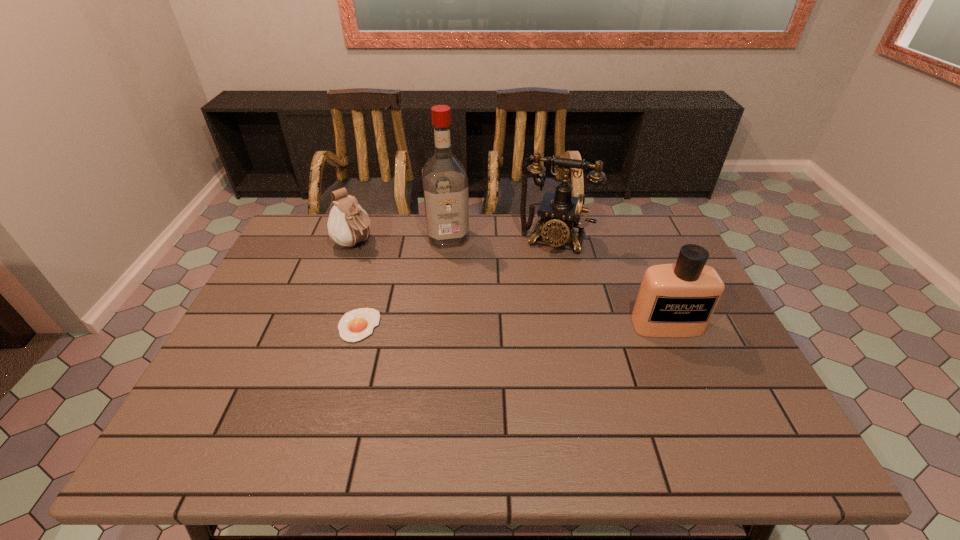
Image resolution: width=960 pixels, height=540 pixels. What are the coordinates of `free space at the near left corner of the desktop` in the screenshot? It's located at (250, 386).

Where is `vacant space at the far right corner`? The image size is (960, 540). vacant space at the far right corner is located at coordinates (641, 237).

Locate an element on the screen. This screenshot has width=960, height=540. free spot between the shortest object and the liquor is located at coordinates (403, 281).

Locate an element on the screen. The image size is (960, 540). vacant space in between the liquor and the third shortest object is located at coordinates (557, 281).

The width and height of the screenshot is (960, 540). I want to click on free space between the telephone and the shortest object, so click(x=457, y=282).

The image size is (960, 540). I want to click on unoccupied area between the fourth object from left to right and the shortest object, so [457, 282].

This screenshot has width=960, height=540. I want to click on free point between the second object from right to left and the third tallest object, so click(x=611, y=282).

Identify the location of free space between the egg yolk and the fourth object from left to right. (457, 282).

The image size is (960, 540). I want to click on vacant space that is in between the third object from left to right and the rightmost object, so click(557, 281).

At what (x,y) coordinates should I click in order to perform the action: click on vacant point located between the telephone and the tallest object. Please return your answer as a coordinate pair (x, y). Image resolution: width=960 pixels, height=540 pixels. Looking at the image, I should click on (501, 239).